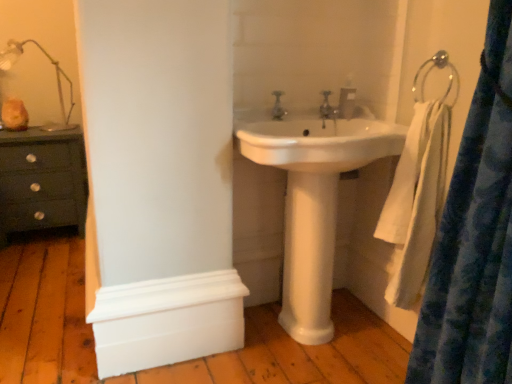
Locate an element on the screen. The width and height of the screenshot is (512, 384). vacant space to the right of matte silver faucet at center, the second tap positioned from the back is located at coordinates pos(310,113).